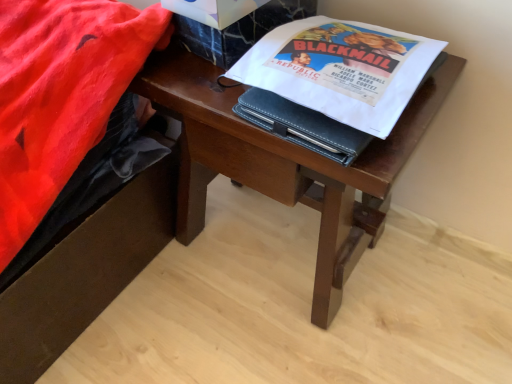
Identify the location of white paper at upper center. (340, 69).

What do you see at coordinates (340, 69) in the screenshot? The height and width of the screenshot is (384, 512). I see `white paper at upper center` at bounding box center [340, 69].

What is the approximate height of white paper at upper center?

white paper at upper center is 3.42 centimeters in height.

This screenshot has height=384, width=512. What do you see at coordinates (284, 162) in the screenshot? I see `wooden desk at center` at bounding box center [284, 162].

Based on the photo, what is the approximate width of wooden desk at center?

It is 13.37 inches.

Locate an element on the screen. Image resolution: width=512 pixels, height=384 pixels. wooden desk at center is located at coordinates (284, 162).

Where is `white paper at upper center`? This screenshot has width=512, height=384. white paper at upper center is located at coordinates (340, 69).

In the scene shown: Does wooden desk at center appear on the right side of white paper at upper center?

No, wooden desk at center is not to the right of white paper at upper center.

Is wooden desk at center further to the viewer compared to white paper at upper center?

Yes.

Is point (337, 214) closer or farther from the camera than point (318, 97)?

Point (337, 214) is positioned farther from the camera compared to point (318, 97).

From the image's perspective, is wooden desk at center located beneath white paper at upper center?

Yes, from the image's perspective, wooden desk at center is beneath white paper at upper center.

From a real-world perspective, who is located higher, wooden desk at center or white paper at upper center?

From a 3D spatial view, white paper at upper center is above.

Considering the relative sizes of wooden desk at center and white paper at upper center in the image provided, is wooden desk at center wider than white paper at upper center?

Indeed, wooden desk at center has a greater width compared to white paper at upper center.

Is wooden desk at center taller or shorter than white paper at upper center?

wooden desk at center is taller than white paper at upper center.

Does wooden desk at center have a larger size compared to white paper at upper center?

Correct, wooden desk at center is larger in size than white paper at upper center.

Is wooden desk at center inside or outside of white paper at upper center?

wooden desk at center cannot be found inside white paper at upper center.

Are wooden desk at center and white paper at upper center beside each other?

No, wooden desk at center is not touching white paper at upper center.

Is wooden desk at center aimed at white paper at upper center?

No.

Can you tell me how much wooden desk at center and white paper at upper center differ in facing direction?

2.32 degrees.

There is a wooden desk at center. What are the coordinates of `paperback book above it (from a real-world perspective)` in the screenshot? It's located at (340, 69).

Can you confirm if white paper at upper center is positioned to the left of wooden desk at center?

Incorrect, white paper at upper center is not on the left side of wooden desk at center.

Is white paper at upper center in front of wooden desk at center?

Yes, white paper at upper center is closer to the viewer.

Considering the positions of points (356, 53) and (259, 135), is point (356, 53) farther from camera compared to point (259, 135)?

No, it is in front of (259, 135).

From the image's perspective, would you say white paper at upper center is positioned over wooden desk at center?

Yes.

From a real-world perspective, who is located higher, white paper at upper center or wooden desk at center?

In real-world perspective, white paper at upper center is above.

Does white paper at upper center have a greater width compared to wooden desk at center?

No, white paper at upper center is not wider than wooden desk at center.

Which of these two, white paper at upper center or wooden desk at center, stands shorter?

Standing shorter between the two is white paper at upper center.

Considering the sizes of white paper at upper center and wooden desk at center in the image, is white paper at upper center bigger or smaller than wooden desk at center?

Considering their sizes, white paper at upper center takes up less space than wooden desk at center.

Does white paper at upper center contain wooden desk at center?

No, white paper at upper center does not contain wooden desk at center.

Is white paper at upper center not near wooden desk at center?

Actually, white paper at upper center and wooden desk at center are a little close together.

Is white paper at upper center looking in the opposite direction of wooden desk at center?

white paper at upper center does not have its back to wooden desk at center.

How different are the orientations of white paper at upper center and wooden desk at center in degrees?

white paper at upper center and wooden desk at center are facing 2.32 degrees away from each other.

At what (x,y) coordinates should I click in order to perform the action: click on paperback book in front of the wooden desk at center. Please return your answer as a coordinate pair (x, y). The image size is (512, 384). Looking at the image, I should click on pyautogui.click(x=340, y=69).

I want to click on desk below the white paper at upper center (from a real-world perspective), so click(284, 162).

What are the coordinates of `paperback book on the right of wooden desk at center` in the screenshot? It's located at (340, 69).